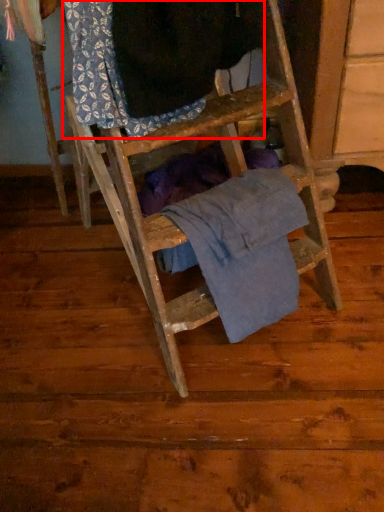
Question: From the image, what is the correct spatial relationship of clothing (annotated by the red box) in relation to clothing?

Choices:
 (A) left
 (B) right

Answer: (A)